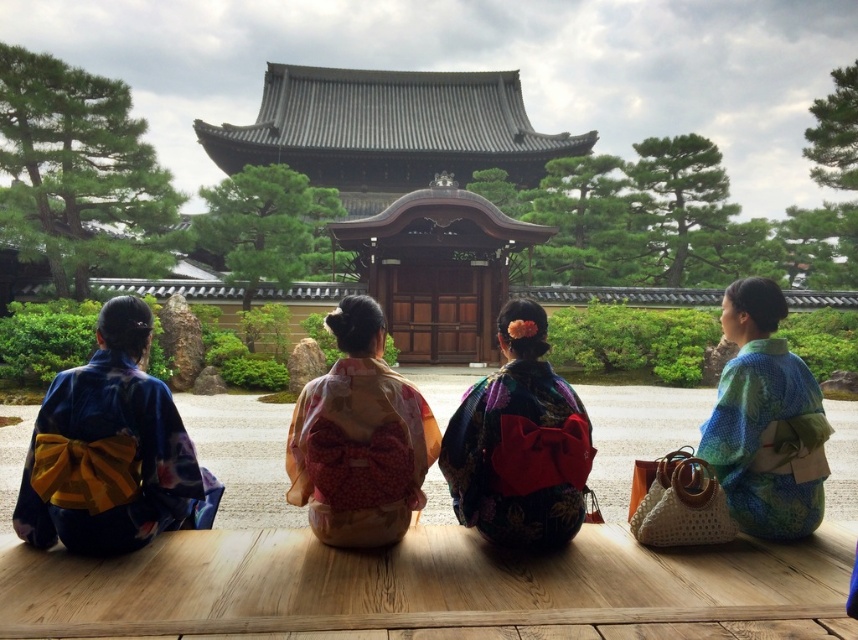
You are a photographer trying to capture a closeup shot of the obi on the matte blue kimono at left and the matte pink kimono at center. Since you want to focus on the obi details, which kimono should you choose to get a clearer image without needing to zoom in more?

The matte blue kimono at left has a larger size compared to the matte pink kimono at center, so choosing the matte blue kimono at left would allow you to capture a clearer image of the obi without needing to zoom in as much due to its larger size.